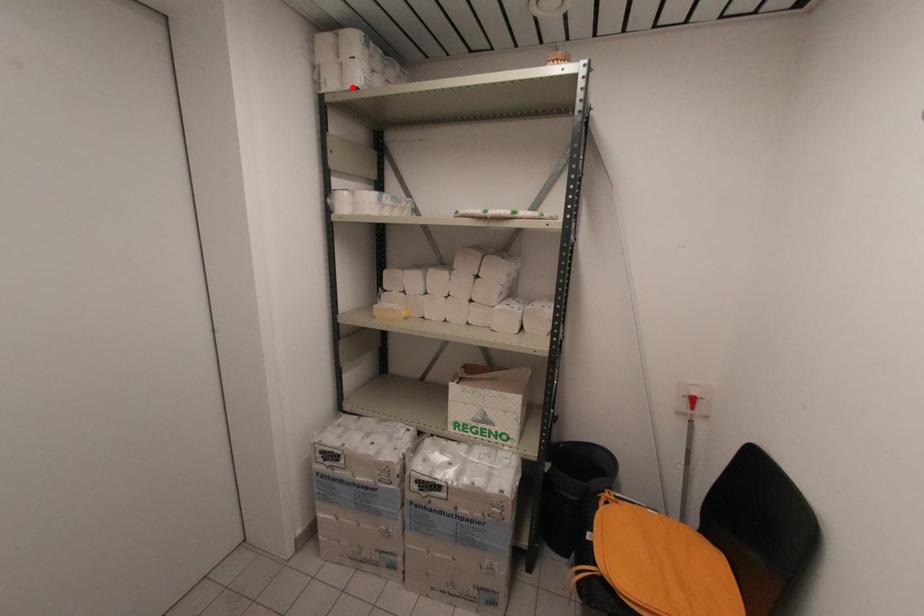
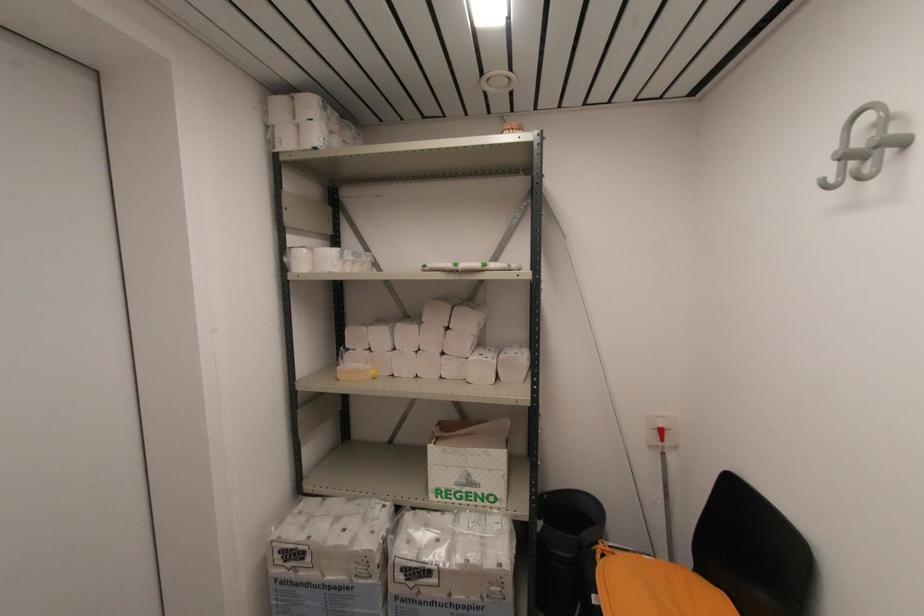
In the second image, find the point that corresponds to the highlighted location in the first image.

(310, 148)